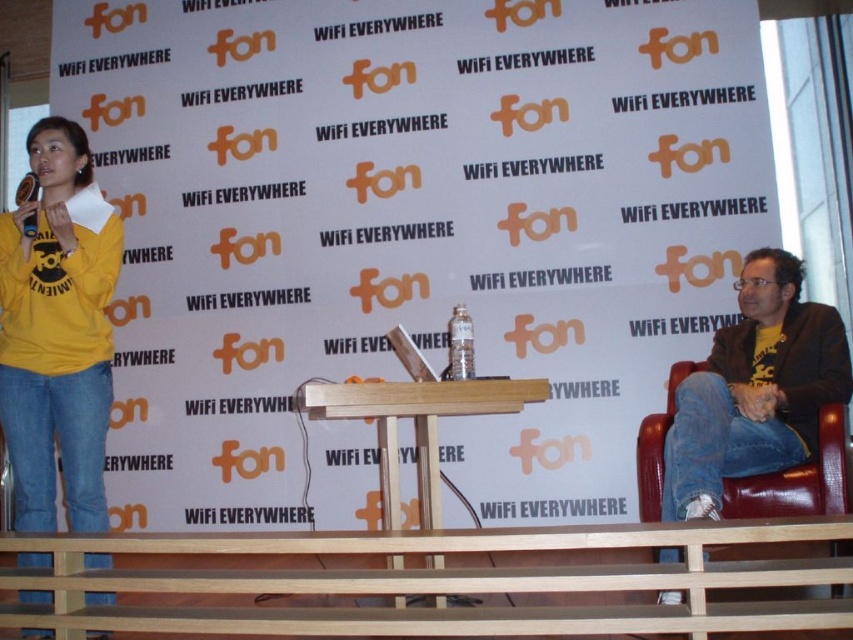
You are organizing a presentation and need to place a new item on the table. The wooden at center and leather at right are already there. Which surface should you choose if you want to place the item on the taller one?

The wooden at center is taller than the leather at right, so you should place the item on the wooden at center.

You are organizing a presentation and need to place a 15 cm wide laptop between the yellow cotton sweatshirt at left and the wooden at center. Can the laptop fit between them?

The yellow cotton sweatshirt at left has a lesser width compared to wooden at center. Since the laptop is 15 cm wide, it depends on the distance between them. However, the description only mentions the width of the objects, not the space between them. Therefore, we cannot determine if the laptop will fit based on the provided information.